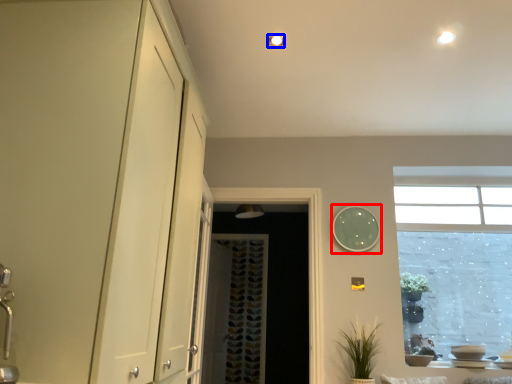
Question: Which object is further to the camera taking this photo, clock (highlighted by a red box) or lighting (highlighted by a blue box)?

Choices:
 (A) clock
 (B) lighting

Answer: (A)